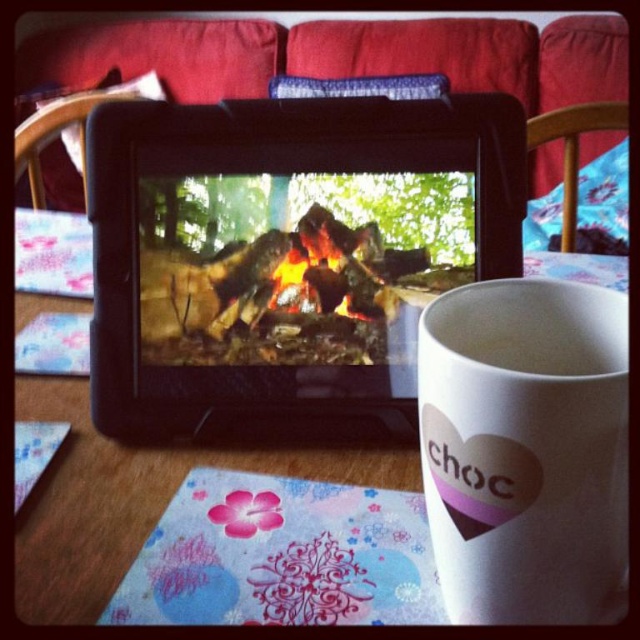
Between wooden table at center and charcoal wood fire at center, which one is positioned lower?

Positioned lower is wooden table at center.

Can you confirm if wooden table at center is bigger than charcoal wood fire at center?

Correct, wooden table at center is larger in size than charcoal wood fire at center.

Does point (49, 406) come farther from viewer compared to point (280, 282)?

That is True.

This screenshot has height=640, width=640. Find the location of `wooden table at center`. wooden table at center is located at coordinates (132, 493).

Is white matte mug at center positioned at the back of wooden table at center?

No, white matte mug at center is closer to the viewer.

Is white matte mug at center positioned before wooden table at center?

That is True.

Between point (476, 412) and point (67, 280), which one is positioned behind?

The point (67, 280) is behind.

Identify the location of white matte mug at center. The height and width of the screenshot is (640, 640). (525, 449).

Does white matte mug at center appear under charcoal wood fire at center?

Answer: Indeed, white matte mug at center is positioned under charcoal wood fire at center.

Looking at this image, is white matte mug at center to the right of charcoal wood fire at center from the viewer's perspective?

Indeed, white matte mug at center is positioned on the right side of charcoal wood fire at center.

Who is more forward, (x=570, y=492) or (x=340, y=252)?

Point (x=570, y=492)

Where is `white matte mug at center`? This screenshot has height=640, width=640. white matte mug at center is located at coordinates (525, 449).